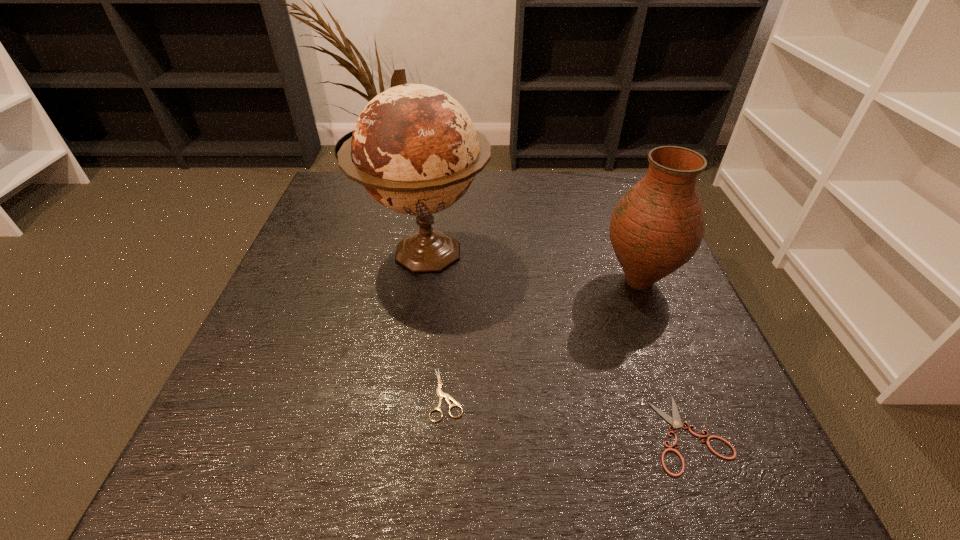
Find the location of `the tallest object`. the tallest object is located at coordinates (414, 148).

The width and height of the screenshot is (960, 540). In order to click on vase in this screenshot , I will do `click(658, 225)`.

Identify the location of the left shears. (440, 393).

Locate an element on the screen. the right shears is located at coordinates [x=676, y=423].

Locate an element on the screen. vacant space located on the front of the globe showing Asia is located at coordinates (392, 486).

This screenshot has height=540, width=960. I want to click on free space located 0.220m on the front of the vase, so click(692, 415).

I want to click on vacant area situated 0.240m on the right of the left shears, so click(x=615, y=394).

Locate an element on the screen. Image resolution: width=960 pixels, height=540 pixels. free space located on the left of the right shears is located at coordinates (475, 434).

The height and width of the screenshot is (540, 960). What are the coordinates of `object positioned at the far edge` in the screenshot? It's located at (414, 148).

Locate an element on the screen. object that is at the near edge is located at coordinates (676, 423).